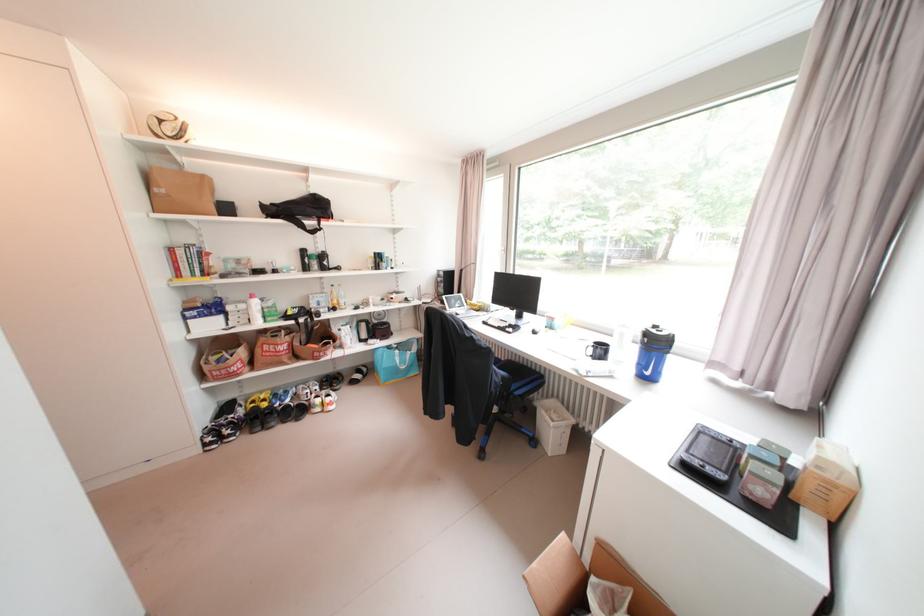
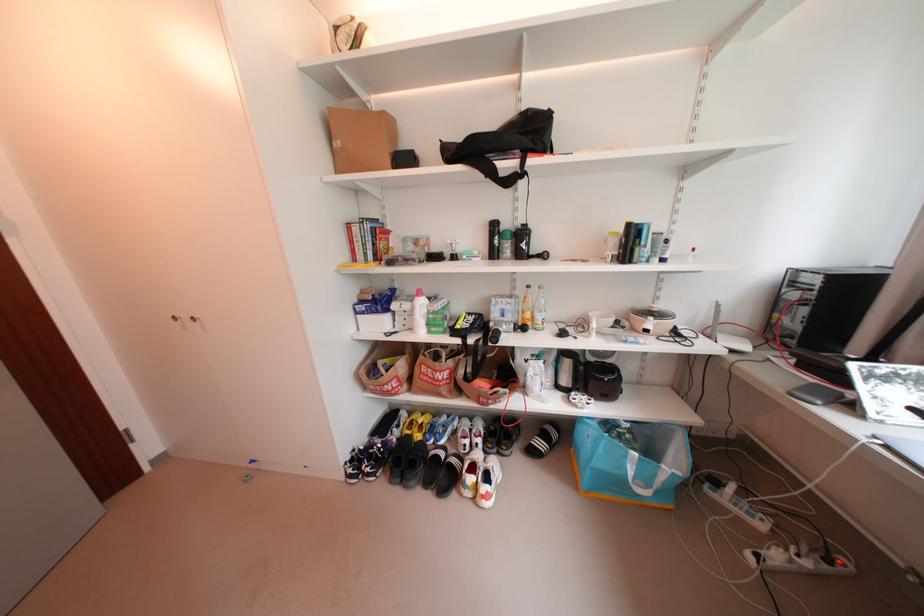
Where in the second image is the point corresponding to (x=372, y=345) from the first image?

(572, 399)